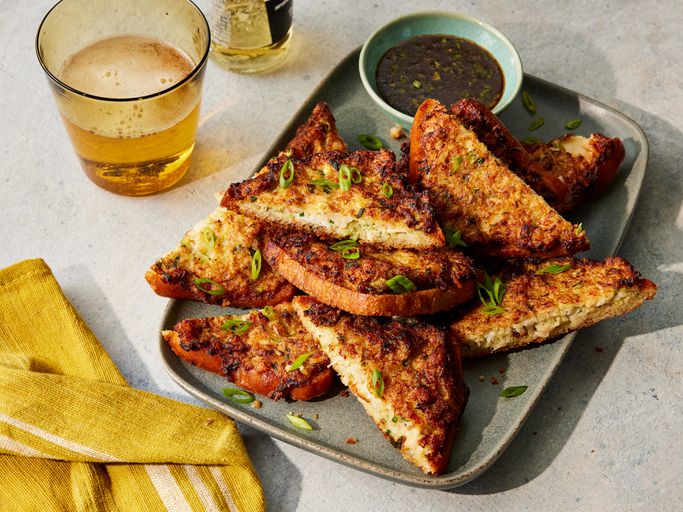
Locate an element on the screen. white strips on napkin is located at coordinates (201, 483), (165, 488), (68, 444), (29, 447).